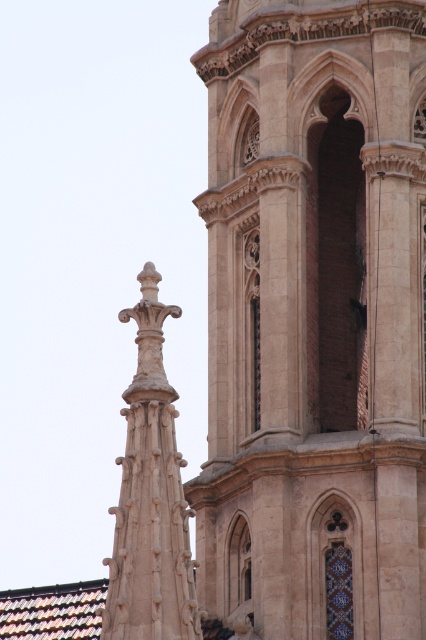
You are standing in front of the historic stone building and want to determine the relative positions of two points marked on the structure. Which of the two points, point (238, 456) or point (152, 497), is closer to you?

Point (238, 456) is further to the camera than point (152, 497), so point (152, 497) is closer to you.

You are a construction worker needing to place a 10 meter long safety net between the beige stone tower at center and the carved stone spire at upper left. Can the safety net fit between them without being stretched?

The distance between the beige stone tower at center and the carved stone spire at upper left is 12.62 meters, which is longer than the 10 meter safety net. Therefore, the safety net cannot fit between them without stretching.

You are standing in front of a historic stone building. The beige stone tower at center is part of this building. If you want to take a photo of the entire tower without moving your camera, what should you consider based on your current position?

The beige stone tower at center is 67.46 meters away from the camera. To capture the entire tower in one photo without moving, ensure your camera has a wide enough lens or adjust your position to include the full structure in the frame.